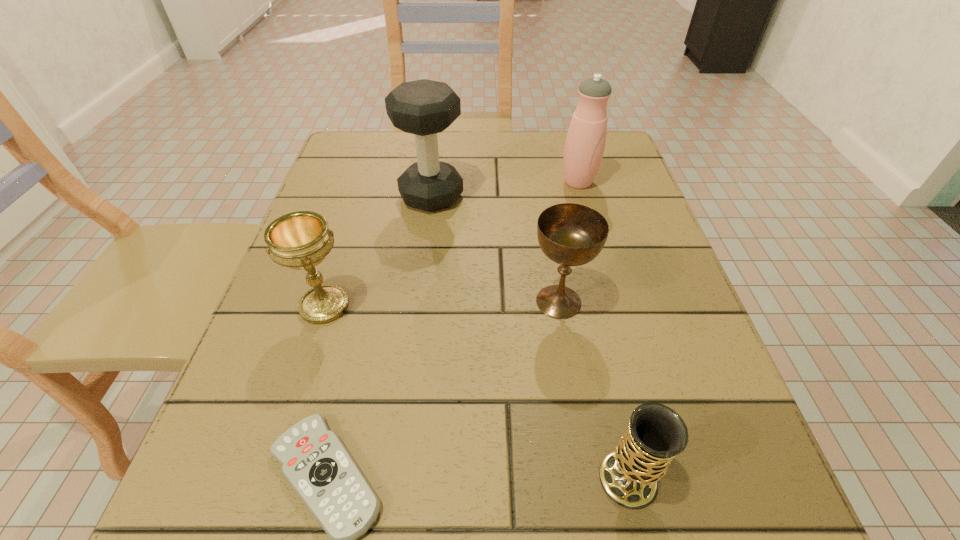
You are a GUI agent. You are given a task and a screenshot of the screen. Output one action in this format:
    pyautogui.click(x=<x>, y=<y>)
    Task: Click on the thermos bottle
    The width and height of the screenshot is (960, 540).
    Given the screenshot: What is the action you would take?
    pyautogui.click(x=585, y=142)

Identify the location of dumbbell. This screenshot has height=540, width=960. (424, 108).

The height and width of the screenshot is (540, 960). What are the coordinates of `the leftmost chalice` in the screenshot? It's located at (301, 240).

At what (x,y) coordinates should I click in order to perform the action: click on the fifth tallest object. Please return your answer as a coordinate pair (x, y). Looking at the image, I should click on (629, 475).

At what (x,y) coordinates should I click in order to perform the action: click on the nearest chalice. Please return your answer as a coordinate pair (x, y). Looking at the image, I should click on (629, 475).

Find the location of `free location located 0.130m on the back of the thermos bottle`. free location located 0.130m on the back of the thermos bottle is located at coordinates (567, 143).

Image resolution: width=960 pixels, height=540 pixels. Find the location of `vacant space located on the front of the dumbbell`. vacant space located on the front of the dumbbell is located at coordinates (423, 259).

Identify the location of blank area located on the back of the leftmost chalice. The width and height of the screenshot is (960, 540). (351, 221).

What are the coordinates of `vacant area located on the left of the fifth tallest object` in the screenshot? It's located at (511, 479).

Where is `thermos bottle present at the far edge`? The width and height of the screenshot is (960, 540). thermos bottle present at the far edge is located at coordinates (585, 142).